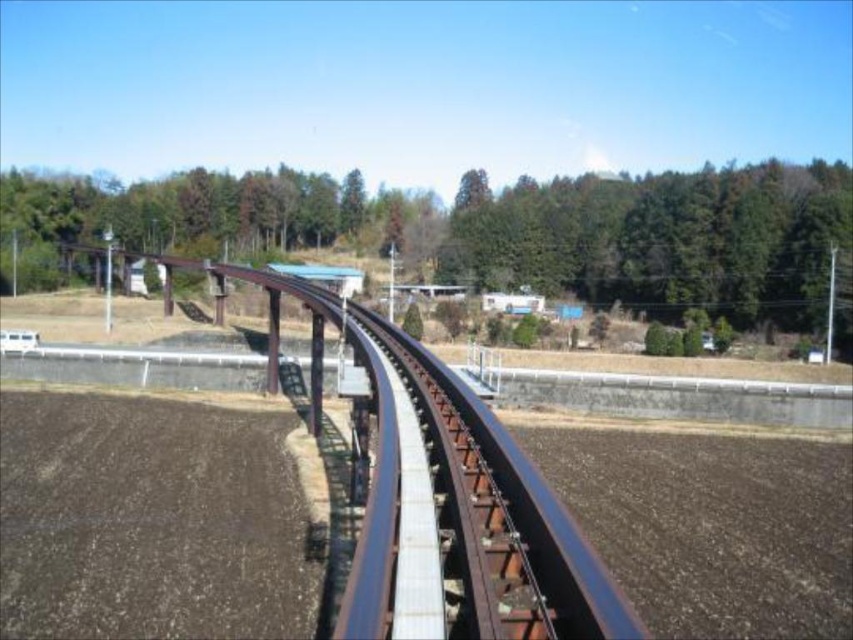
You are standing at the point marked as point (505, 230) in the image. Looking around, you see the railway tracks and agricultural fields. What is directly behind you?

The point (505, 230) is on a green leafy tree at upper center, so directly behind you would be the tree itself.

You are a landscape architect planning to plant a new row of trees between the brown soil at lower left and the green leafy trees at upper center. The recommended spacing between each tree is 5 meters. How many trees can be planted in a straight line between these two points?

The distance between the brown soil at lower left and the green leafy trees at upper center is 274.76 meters. Dividing this distance by the recommended spacing of 5 meters gives approximately 54.95 trees. Since you can only plant whole trees, the maximum number of trees that can be planted is 54.